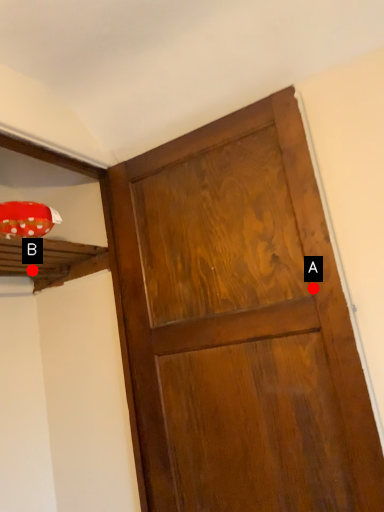
Question: Two points are circled on the image, labeled by A and B beside each circle. Which point is further to the camera?

Choices:
 (A) A is further
 (B) B is further

Answer: (B)